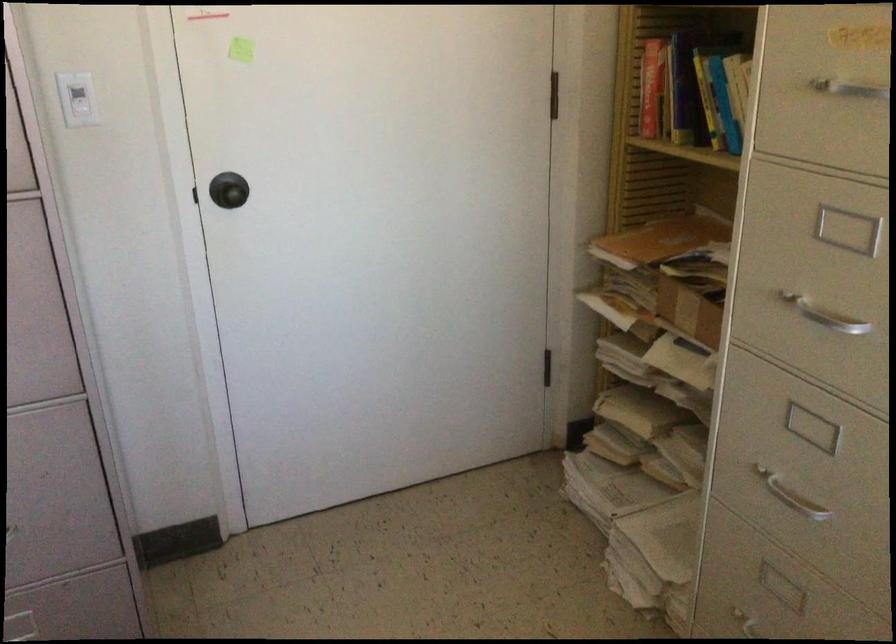
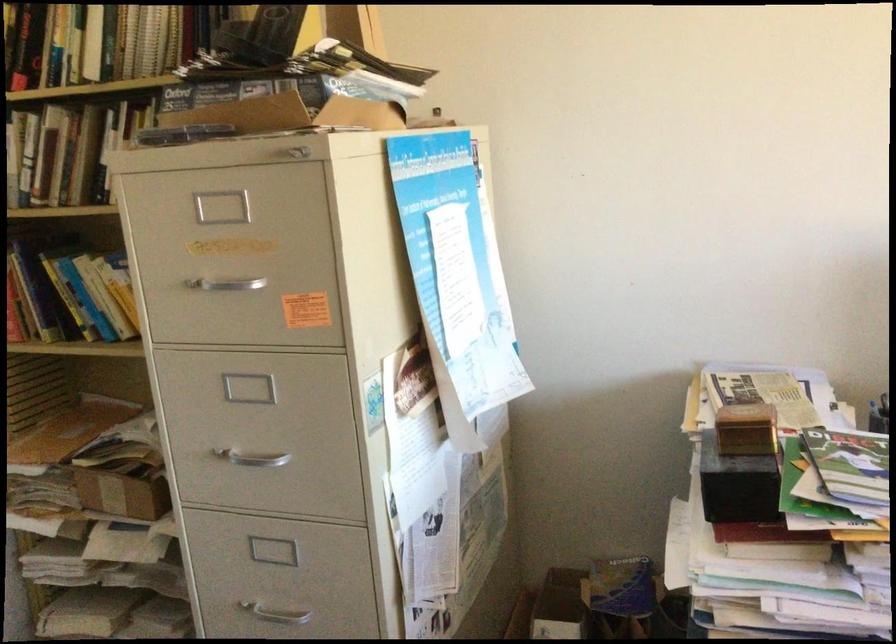
The point at (x=695, y=307) is marked in the first image. Where is the corresponding point in the second image?

(123, 488)